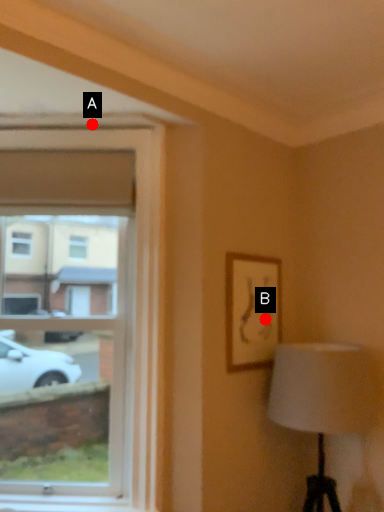
Question: Two points are circled on the image, labeled by A and B beside each circle. Which point is farther from the camera taking this photo?

Choices:
 (A) A is further
 (B) B is further

Answer: (B)